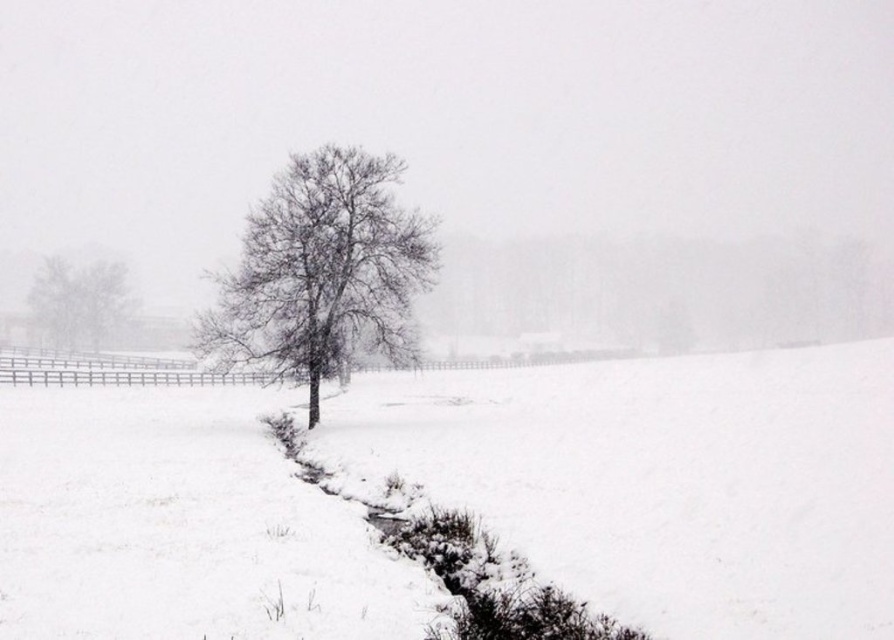
You are standing at the snowy dirt trench at lower center and want to throw a snowball to someone exactly 10 meters away from you. Is the viewer within the throwing range?

The viewer and the snowy dirt trench at lower center are 9.32 meters apart, so yes, the viewer is within the throwing range since 9.32 meters is less than 10 meters.

You are standing at the point labeled point (350, 246) and want to walk to the point labeled point (35, 326). According to the scene, will you have to walk towards the foreground or the background?

Since point (350, 246) is in front of point (35, 326), you would need to walk towards the background to reach point (35, 326) from your current position.